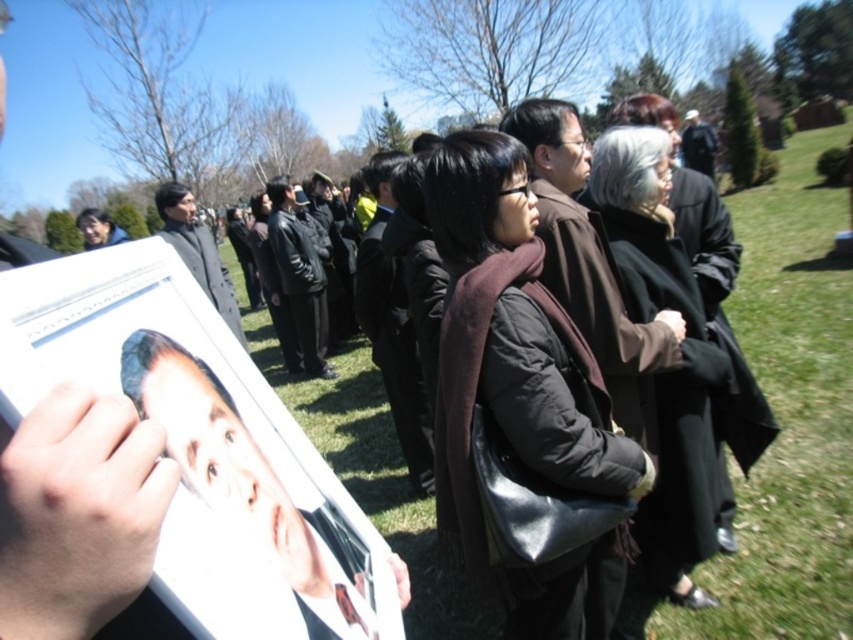
Does dark brown wool scarf at center have a lesser width compared to black wool coat at center?

Yes, dark brown wool scarf at center is thinner than black wool coat at center.

Is dark brown wool scarf at center above black wool coat at center?

Actually, dark brown wool scarf at center is below black wool coat at center.

Who is more forward, (465, 216) or (712, 476)?

Point (465, 216) is in front.

Locate an element on the screen. The image size is (853, 640). dark brown wool scarf at center is located at coordinates (520, 390).